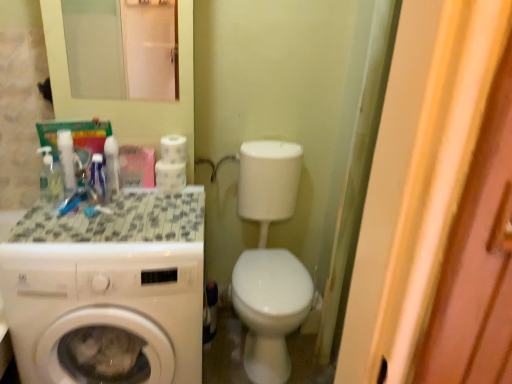
Question: Would you say white glossy mouthwash at upper left, placed as the 1th mouthwash when sorted from right to left, is to the left or to the right of white matte toilet paper at upper center, which is counted as the first toilet paper, starting from the top, in the picture?

Choices:
 (A) right
 (B) left

Answer: (B)

Question: From the image's perspective, is white glossy mouthwash at upper left, which is the third mouthwash from left to right, positioned above or below white matte toilet paper at upper center, which is the 2th toilet paper in bottom-to-top order?

Choices:
 (A) below
 (B) above

Answer: (A)

Question: Estimate the real-world distances between objects in this image. Which object is farther from the white glossy faucet at upper center?

Choices:
 (A) white glossy mouthwash at left, placed as the 2th mouthwash when sorted from right to left
 (B) white glossy washing machine at left
 (C) white matte toilet paper at center, arranged as the 2th toilet paper when viewed from the top
 (D) transparent glass mirror at upper center
 (E) white matte toilet paper at upper center, which is counted as the first toilet paper, starting from the top

Answer: (B)

Question: Estimate the real-world distances between objects in this image. Which object is farther from the white glossy mouthwash at upper left, which is the third mouthwash from left to right?

Choices:
 (A) clear plastic mouthwash at upper left, the first mouthwash from the left
 (B) tile mosaic countertop at left
 (C) white glossy faucet at upper center
 (D) white glossy washing machine at left
 (E) white glossy mouthwash at left, placed as the 2th mouthwash when sorted from right to left

Answer: (C)